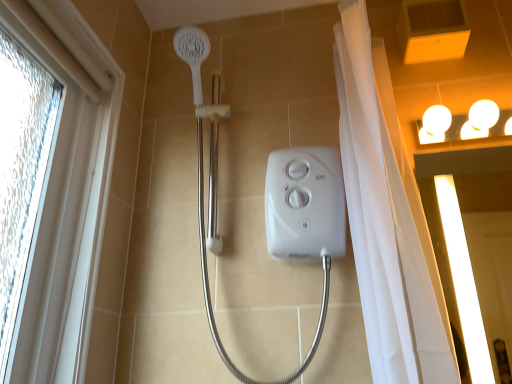
Question: Considering their positions, is white textured window at left located in front of or behind white glossy light fixture at upper right?

Choices:
 (A) front
 (B) behind

Answer: (A)

Question: From the image's perspective, is white textured window at left located above or below white glossy light fixture at upper right?

Choices:
 (A) below
 (B) above

Answer: (A)

Question: Which object is the closest to the white glossy screen door at upper right?

Choices:
 (A) white glossy light fixture at upper right
 (B) white textured window at left

Answer: (A)

Question: Which of these objects is positioned closest to the white textured window at left?

Choices:
 (A) white glossy light fixture at upper right
 (B) white glossy screen door at upper right

Answer: (A)